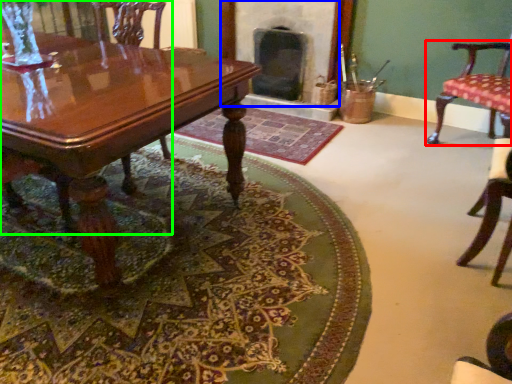
Question: Which is farther away from chair (highlighted by a red box)? fireplace (highlighted by a blue box) or chair (highlighted by a green box)?

Choices:
 (A) fireplace
 (B) chair

Answer: (B)